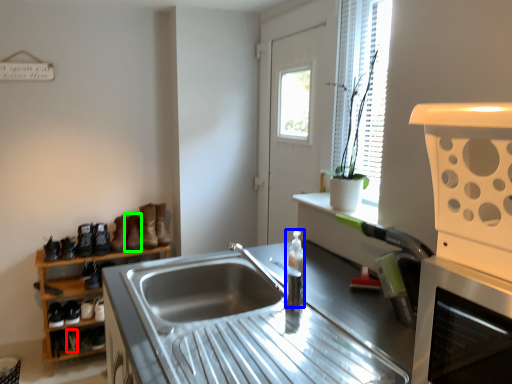
Question: Estimate the real-world distances between objects in this image. Which object is closer to shoe (highlighted by a red box), bottle (highlighted by a blue box) or boot (highlighted by a green box)?

Choices:
 (A) bottle
 (B) boot

Answer: (B)